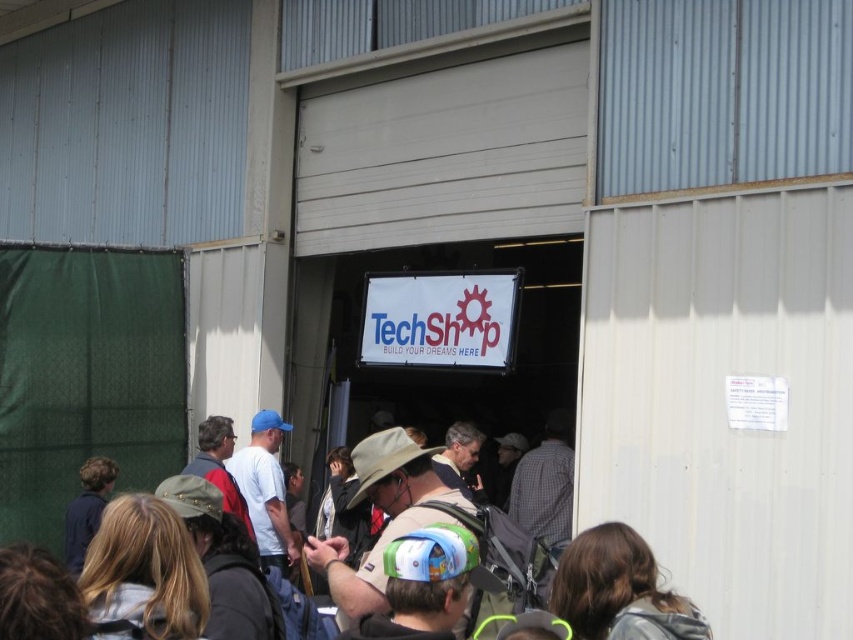
Question: Which point appears farthest from the camera in this image?

Choices:
 (A) (245, 536)
 (B) (403, 320)

Answer: (B)

Question: Does brown fabric backpack at center appear under white fabric sign at center?

Choices:
 (A) yes
 (B) no

Answer: (A)

Question: Which of the following is the closest to the observer?

Choices:
 (A) brown fabric backpack at center
 (B) white fabric sign at center

Answer: (A)

Question: Which of the following is the closest to the observer?

Choices:
 (A) (515, 317)
 (B) (659, 608)

Answer: (B)

Question: Is brown fabric backpack at center positioned behind white fabric sign at center?

Choices:
 (A) yes
 (B) no

Answer: (B)

Question: Is brown fabric backpack at center wider than white fabric sign at center?

Choices:
 (A) no
 (B) yes

Answer: (A)